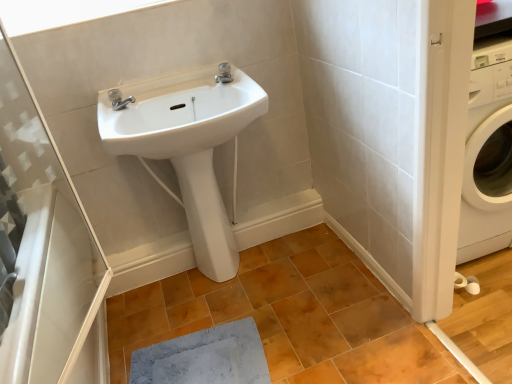
The height and width of the screenshot is (384, 512). What are the coordinates of `vacant space behind polished chrome faucet at upper center, placed as the first tap when sorted from left to right` in the screenshot? It's located at (138, 97).